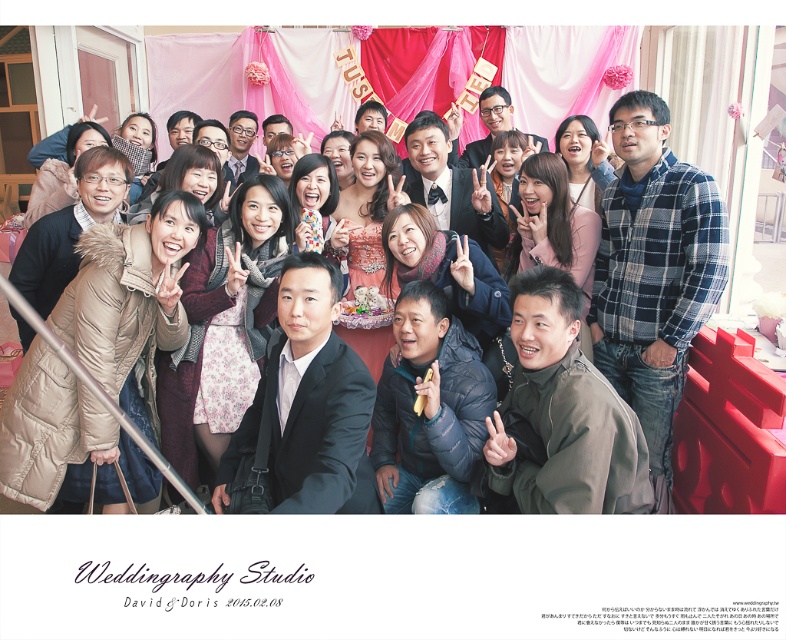
In the wedding group photo by Weddinggraphy Studio, you notice two items at the center of the image labeled as the matte black jacket at center and the matte black dress at center. From an observer standing in front of the photo, which item is positioned lower in the frame?

The matte black jacket at center is positioned below the matte black dress at center, so the matte black jacket at center is lower in the frame.